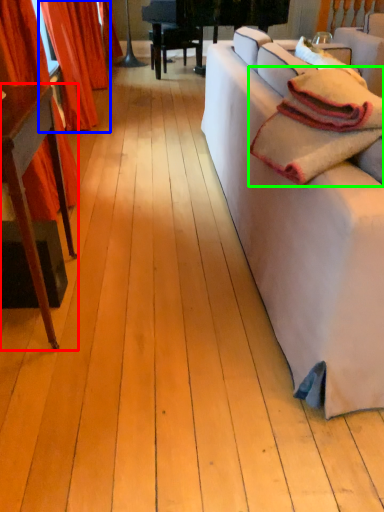
Question: Which is farther away from table (highlighted by a red box)? curtain (highlighted by a blue box) or blanket (highlighted by a green box)?

Choices:
 (A) curtain
 (B) blanket

Answer: (A)